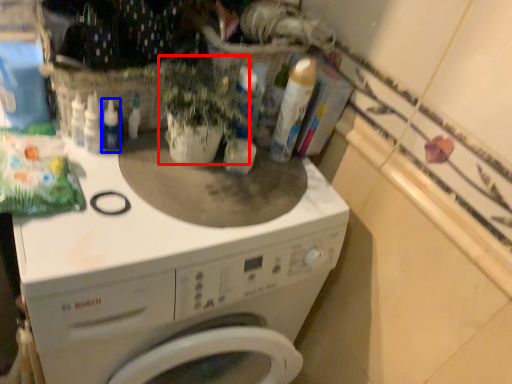
Question: Which of the following is the closest to the observer, plant (highlighted by a red box) or bottle (highlighted by a blue box)?

Choices:
 (A) plant
 (B) bottle

Answer: (A)